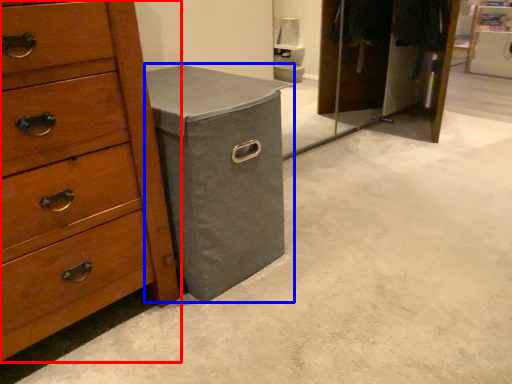
Question: Which point is further to the camera, chest of drawers (highlighted by a red box) or cabinetry (highlighted by a blue box)?

Choices:
 (A) chest of drawers
 (B) cabinetry

Answer: (B)